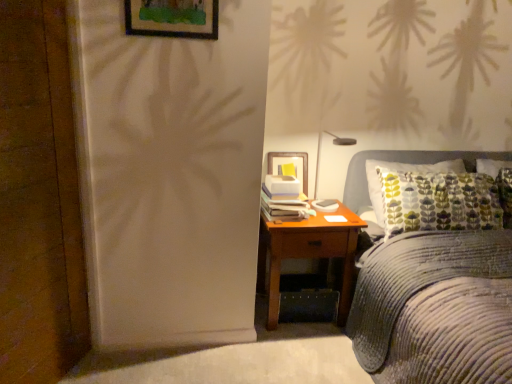
What is the approximate width of brown wooden nightstand at right?

It is 19.41 inches.

What is the approximate width of matte black lamp at upper right?

The width of matte black lamp at upper right is 18.66 inches.

Identify the location of matte black lamp at upper right. The width and height of the screenshot is (512, 384). (334, 144).

I want to click on corduroy fabric bed at right, so click(436, 309).

Is matte black lamp at upper right positioned with its back to brown wooden nightstand at right?

No, brown wooden nightstand at right is not at the back of matte black lamp at upper right.

In the scene shown: Can you confirm if matte black lamp at upper right is smaller than brown wooden nightstand at right?

Yes, matte black lamp at upper right is smaller than brown wooden nightstand at right.

Is there a large distance between matte black lamp at upper right and brown wooden nightstand at right?

No, matte black lamp at upper right is not far away from brown wooden nightstand at right.

Is matte black lamp at upper right inside the boundaries of brown wooden nightstand at right, or outside?

matte black lamp at upper right cannot be found inside brown wooden nightstand at right.

Is matte black lamp at upper right far away from corduroy fabric bed at right?

No, matte black lamp at upper right is not far away from corduroy fabric bed at right.

Considering the points (318, 138) and (449, 349), which point is in front, point (318, 138) or point (449, 349)?

The point (449, 349) is more forward.

The width and height of the screenshot is (512, 384). I want to click on bed below the matte black lamp at upper right (from the image's perspective), so click(436, 309).

From the image's perspective, which one is positioned higher, matte black lamp at upper right or corduroy fabric bed at right?

matte black lamp at upper right.

Is corduroy fabric bed at right not near wooden picture frame at upper center?

corduroy fabric bed at right is far away from wooden picture frame at upper center.

Considering the relative sizes of corduroy fabric bed at right and wooden picture frame at upper center in the image provided, is corduroy fabric bed at right thinner than wooden picture frame at upper center?

No.

Based on the photo, can wooden picture frame at upper center be found inside corduroy fabric bed at right?

Definitely not — wooden picture frame at upper center is not inside corduroy fabric bed at right.

Is corduroy fabric bed at right taller or shorter than wooden picture frame at upper center?

In the image, corduroy fabric bed at right appears to be taller than wooden picture frame at upper center.

Which object is thinner, brown wooden nightstand at right or matte black lamp at upper right?

matte black lamp at upper right is thinner.

Does brown wooden nightstand at right touch matte black lamp at upper right?

brown wooden nightstand at right and matte black lamp at upper right are not in contact.

Does brown wooden nightstand at right turn towards matte black lamp at upper right?

No.

From a real-world perspective, which is physically below, brown wooden nightstand at right or matte black lamp at upper right?

brown wooden nightstand at right.

Based on the photo, which object is more forward, brown wooden nightstand at right or wooden picture frame at upper center?

wooden picture frame at upper center is more forward.

Consider the image. Would you say brown wooden nightstand at right is outside wooden picture frame at upper center?

Indeed, brown wooden nightstand at right is completely outside wooden picture frame at upper center.

Considering the relative sizes of brown wooden nightstand at right and wooden picture frame at upper center in the image provided, is brown wooden nightstand at right thinner than wooden picture frame at upper center?

In fact, brown wooden nightstand at right might be wider than wooden picture frame at upper center.

The height and width of the screenshot is (384, 512). What are the coordinates of `picture frame in front of the brown wooden nightstand at right` in the screenshot? It's located at (172, 18).

From the picture: Measure the distance between corduroy fabric bed at right and brown wooden nightstand at right.

corduroy fabric bed at right is 17.04 inches away from brown wooden nightstand at right.

Can you confirm if corduroy fabric bed at right is shorter than brown wooden nightstand at right?

No.

Could you tell me if corduroy fabric bed at right is facing brown wooden nightstand at right?

No.

Is corduroy fabric bed at right behind brown wooden nightstand at right?

No, corduroy fabric bed at right is closer to the camera.

From the picture: How many degrees apart are the facing directions of wooden picture frame at upper center and corduroy fabric bed at right?

The angular difference between wooden picture frame at upper center and corduroy fabric bed at right is 0.0861 degrees.

Consider the image. Is wooden picture frame at upper center at the left side of corduroy fabric bed at right?

Correct, you'll find wooden picture frame at upper center to the left of corduroy fabric bed at right.

Identify the location of bed below the wooden picture frame at upper center (from a real-world perspective). The width and height of the screenshot is (512, 384). (436, 309).

Is point (213, 2) closer to viewer compared to point (348, 326)?

Yes, point (213, 2) is closer to viewer.

The image size is (512, 384). I want to click on nightstand behind the matte black lamp at upper right, so click(308, 252).

Locate an element on the screen. This screenshot has width=512, height=384. bed below the matte black lamp at upper right (from a real-world perspective) is located at coordinates (436, 309).

Considering their positions, is corduroy fabric bed at right positioned closer to wooden picture frame at upper center than brown wooden nightstand at right?

Based on the image, brown wooden nightstand at right appears to be nearer to wooden picture frame at upper center.

Which object lies nearer to the anchor point wooden picture frame at upper center, corduroy fabric bed at right or matte black lamp at upper right?

Based on the image, matte black lamp at upper right appears to be nearer to wooden picture frame at upper center.

In the scene shown: Considering their positions, is corduroy fabric bed at right positioned further to matte black lamp at upper right than wooden picture frame at upper center?

The object further to matte black lamp at upper right is wooden picture frame at upper center.

Considering their positions, is wooden picture frame at upper center positioned further to brown wooden nightstand at right than matte black lamp at upper right?

The object further to brown wooden nightstand at right is wooden picture frame at upper center.

When comparing their distances from matte black lamp at upper right, does wooden picture frame at upper center or corduroy fabric bed at right seem further?

wooden picture frame at upper center.

Considering their positions, is brown wooden nightstand at right positioned further to matte black lamp at upper right than wooden picture frame at upper center?

wooden picture frame at upper center is further to matte black lamp at upper right.

Considering their positions, is matte black lamp at upper right positioned further to corduroy fabric bed at right than wooden picture frame at upper center?

wooden picture frame at upper center.

From the picture: From the image, which object appears to be nearer to brown wooden nightstand at right, matte black lamp at upper right or wooden picture frame at upper center?

The object closer to brown wooden nightstand at right is matte black lamp at upper right.

Find the location of a particular element. This screenshot has height=384, width=512. bedside lamp that lies between wooden picture frame at upper center and brown wooden nightstand at right from top to bottom is located at coordinates (334, 144).

At what (x,y) coordinates should I click in order to perform the action: click on nightstand situated between wooden picture frame at upper center and corduroy fabric bed at right from left to right. Please return your answer as a coordinate pair (x, y). Looking at the image, I should click on (308, 252).

Identify the location of bedside lamp located between corduroy fabric bed at right and brown wooden nightstand at right in the depth direction. (334, 144).

Find the location of a particular element. bedside lamp situated between wooden picture frame at upper center and corduroy fabric bed at right from left to right is located at coordinates (334, 144).